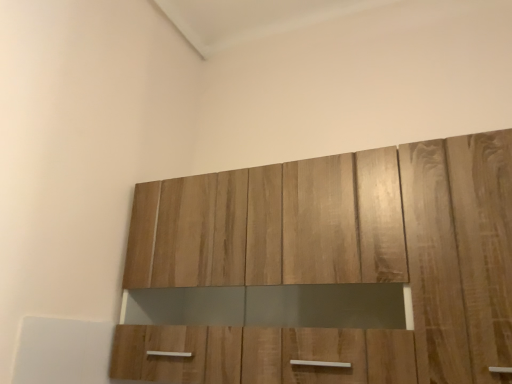
Question: Should I look upward or downward to see wooden cabinet at upper center?

Choices:
 (A) down
 (B) up

Answer: (A)